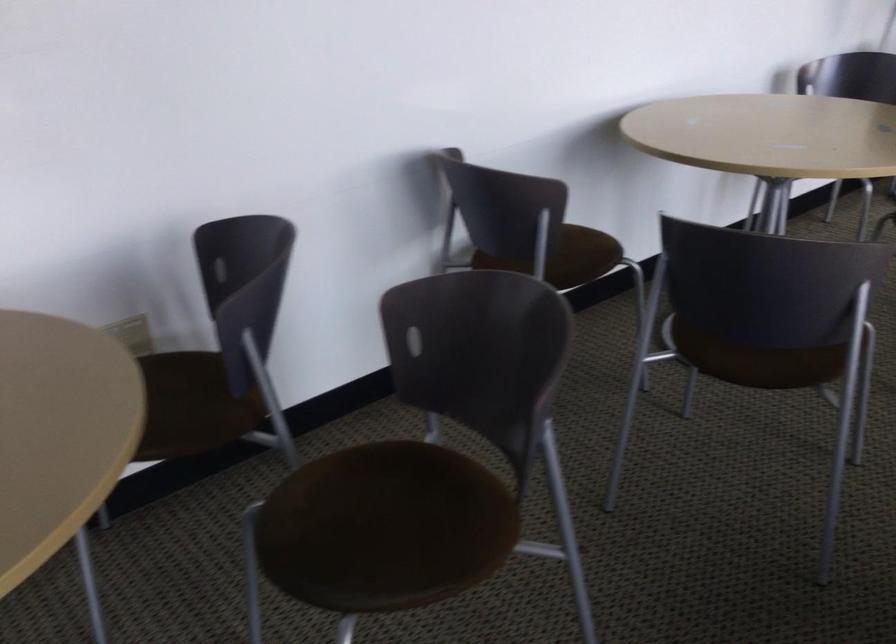
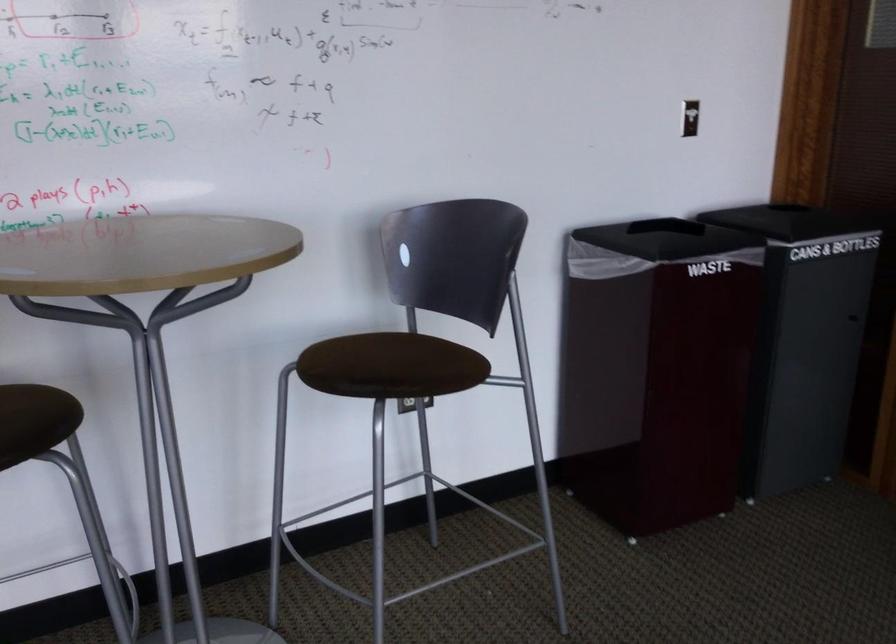
The images are taken continuously from a first-person perspective. In which direction are you moving?

The movement direction of the cameraman is right, forward.